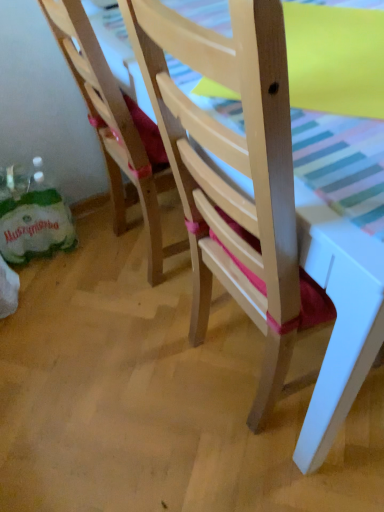
Question: Is matte yellow table at upper right inside or outside of wooden chair at lower left, the second chair when ordered from right to left?

Choices:
 (A) outside
 (B) inside

Answer: (A)

Question: Is point (370, 20) positioned closer to the camera than point (135, 186)?

Choices:
 (A) closer
 (B) farther

Answer: (A)

Question: Estimate the real-world distances between objects in this image. Which object is closer to the wooden chair at center, which is the first chair from right to left?

Choices:
 (A) wooden chair at lower left, the second chair when ordered from right to left
 (B) matte yellow table at upper right

Answer: (B)

Question: Which is farther from the wooden chair at center, marked as the second chair in a left-to-right arrangement?

Choices:
 (A) wooden chair at lower left, arranged as the first chair when viewed from the left
 (B) matte yellow table at upper right

Answer: (A)